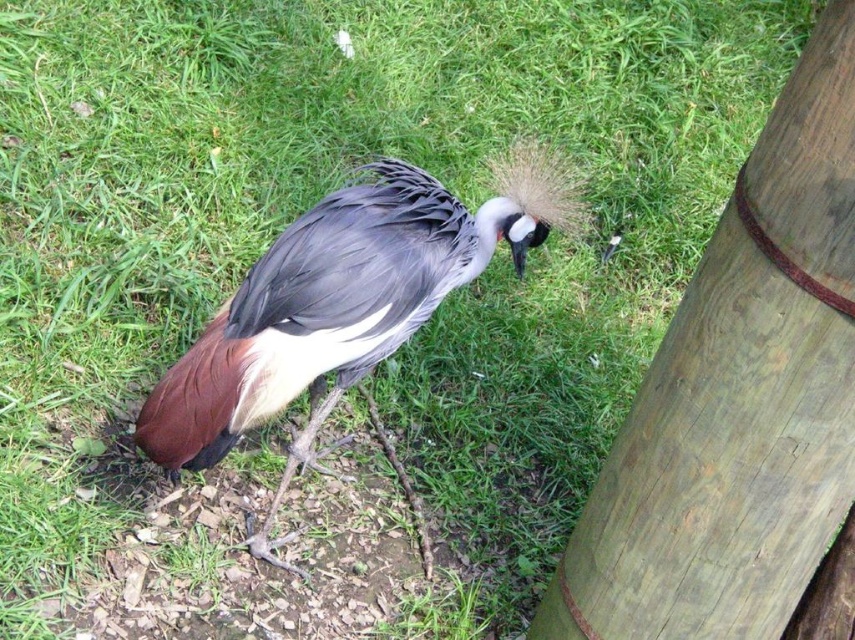
Is the position of wooden pole at right more distant than that of brown feathered bird at center?

No, it is in front of brown feathered bird at center.

Which is below, wooden pole at right or brown feathered bird at center?

wooden pole at right

Is point (736, 344) more distant than point (227, 308)?

No, it is in front of (227, 308).

In order to click on wooden pole at right in this screenshot , I will do `click(740, 404)`.